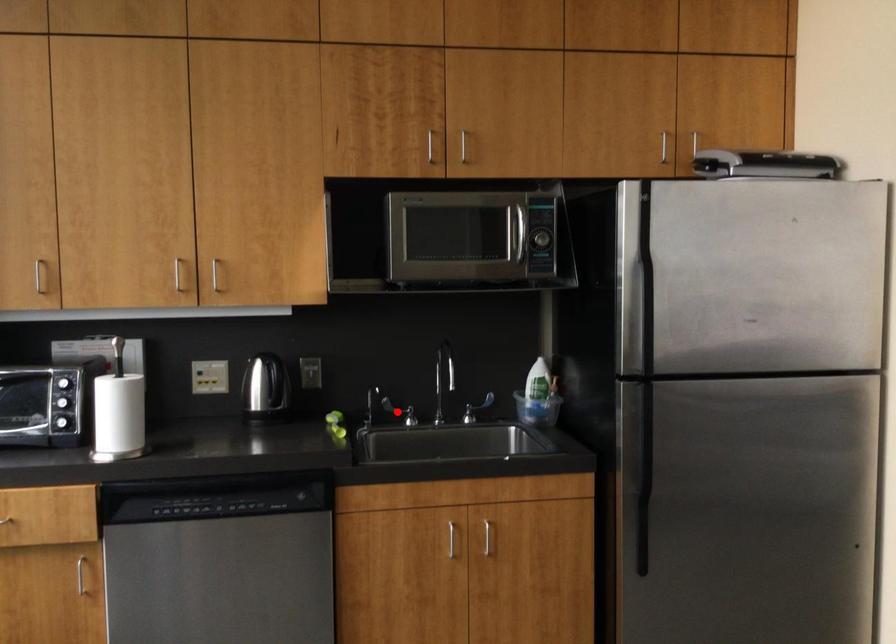
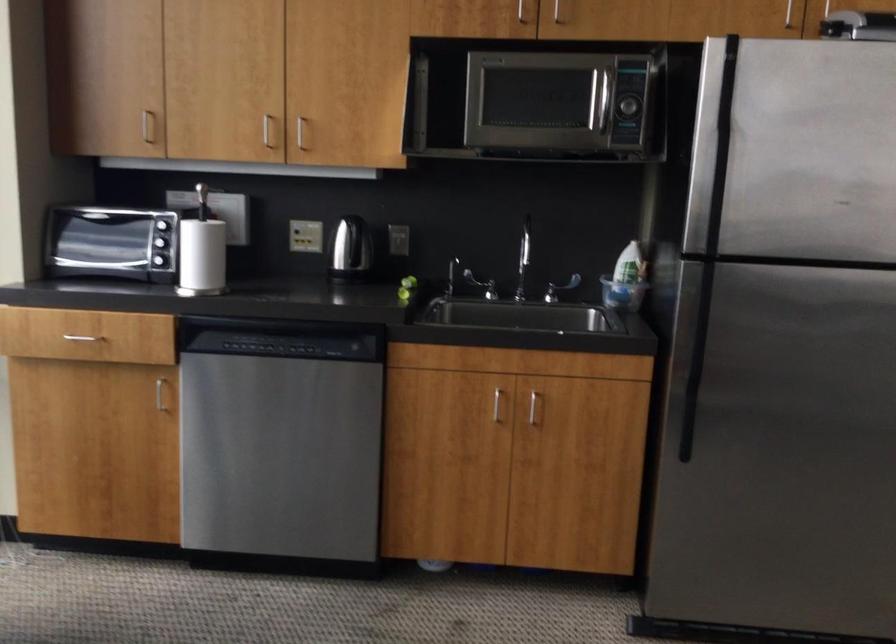
Find the pixel in the second image that matches the highlighted location in the first image.

(480, 285)